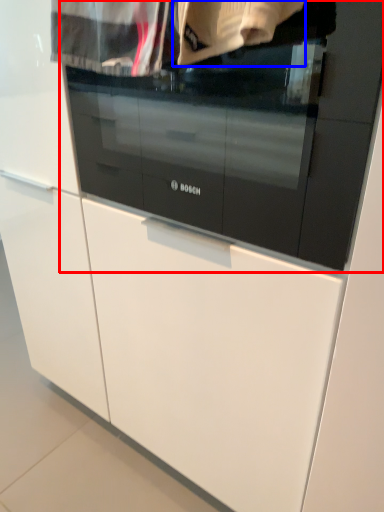
Question: Which of the following is the closest to the observer, oven (highlighted by a red box) or clothing (highlighted by a blue box)?

Choices:
 (A) oven
 (B) clothing

Answer: (B)